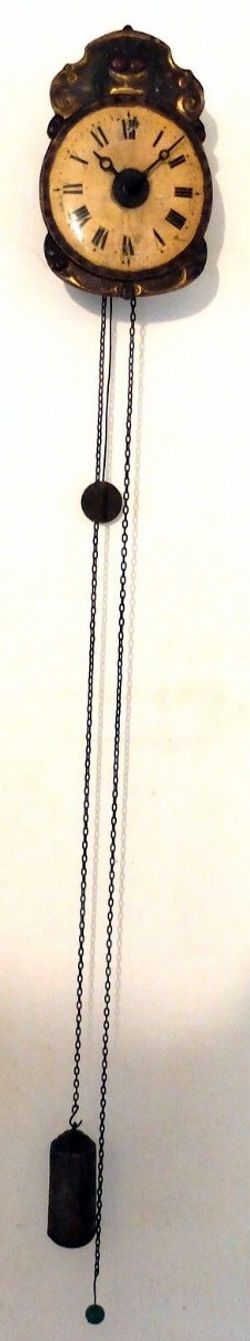
Find the location of a particular element. This screenshot has height=1341, width=250. hook is located at coordinates (116, 1191), (73, 1116).